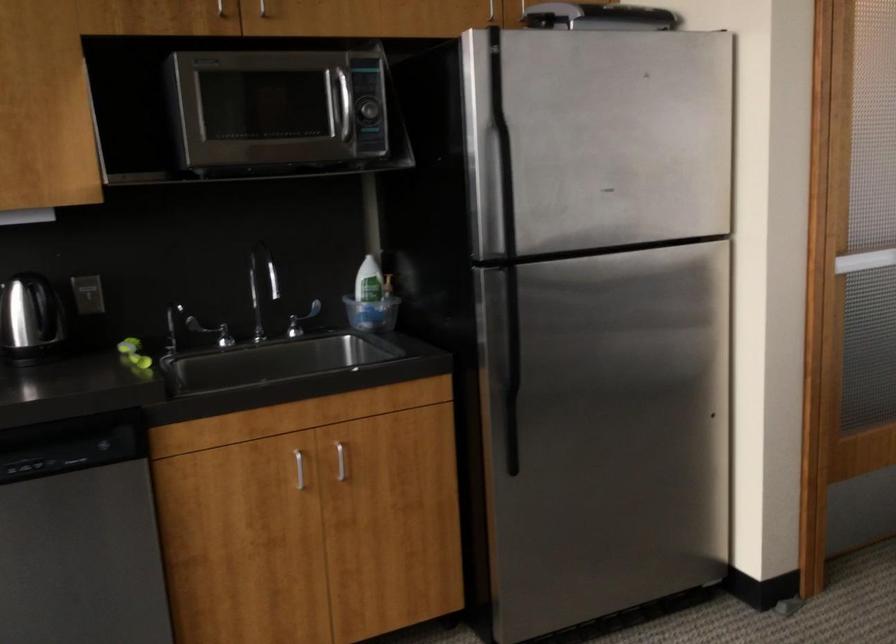
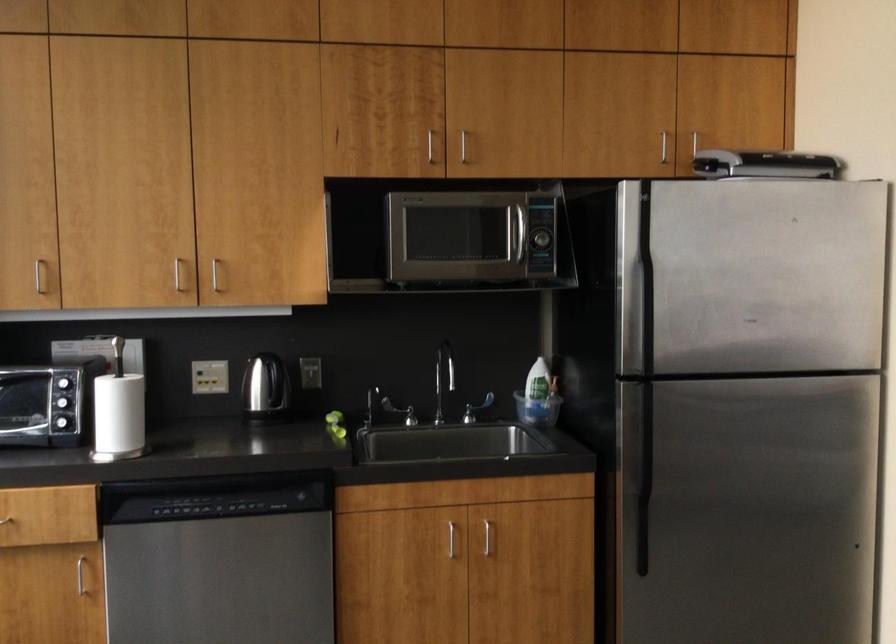
The point at (255,279) is marked in the first image. Where is the corresponding point in the second image?

(444, 371)